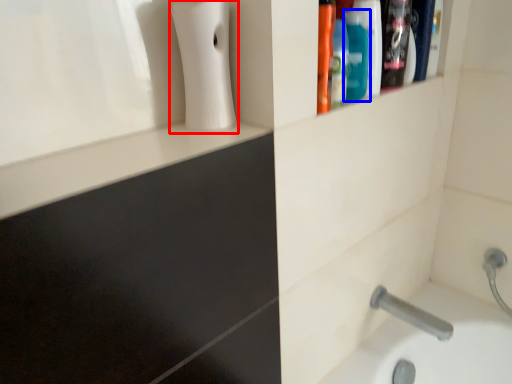
Question: Which object appears closest to the camera in this image, soap dispenser (highlighted by a red box) or mouthwash (highlighted by a blue box)?

Choices:
 (A) soap dispenser
 (B) mouthwash

Answer: (A)